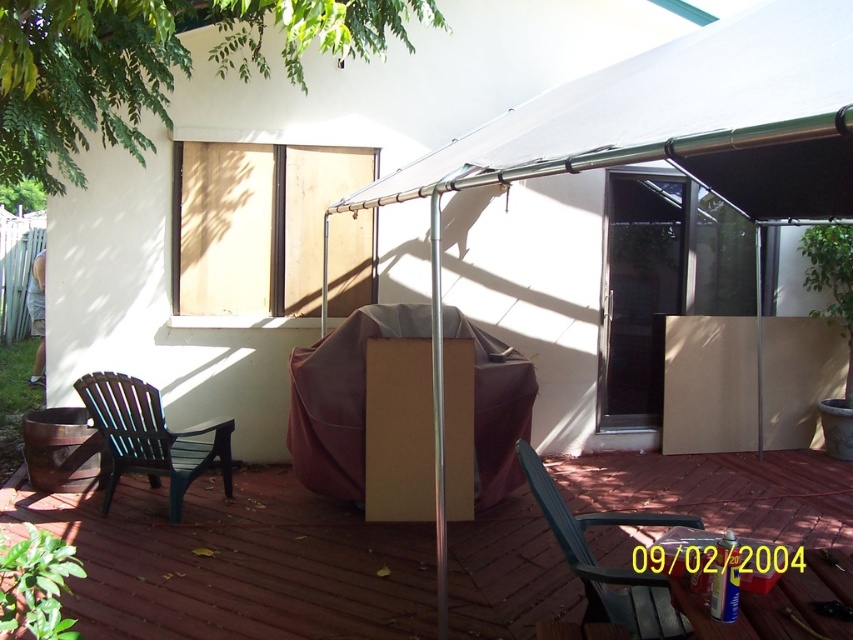
Between brown cardboard box at center and transparent glass screen door at center, which one has more height?

With more height is transparent glass screen door at center.

Does brown cardboard box at center have a smaller size compared to transparent glass screen door at center?

Correct, brown cardboard box at center occupies less space than transparent glass screen door at center.

Who is more forward, [757,522] or [659,416]?

Point [757,522] is more forward.

This screenshot has height=640, width=853. I want to click on brown cardboard box at center, so click(x=238, y=563).

Who is higher up, transparent glass screen door at center or green plastic armchair at lower left?

Positioned higher is transparent glass screen door at center.

Can you confirm if transparent glass screen door at center is positioned to the left of green plastic armchair at lower left?

Incorrect, transparent glass screen door at center is not on the left side of green plastic armchair at lower left.

This screenshot has height=640, width=853. What do you see at coordinates (637, 292) in the screenshot?
I see `transparent glass screen door at center` at bounding box center [637, 292].

At what (x,y) coordinates should I click in order to perform the action: click on transparent glass screen door at center. Please return your answer as a coordinate pair (x, y). Looking at the image, I should click on (637, 292).

Is point (109, 477) positioned before point (606, 609)?

No.

Does black plastic armchair at left appear on the left side of green plastic armchair at lower left?

Yes, black plastic armchair at left is to the left of green plastic armchair at lower left.

Is point (122, 433) positioned behind point (660, 580)?

Yes.

Locate an element on the screen. Image resolution: width=853 pixels, height=640 pixels. black plastic armchair at left is located at coordinates (149, 436).